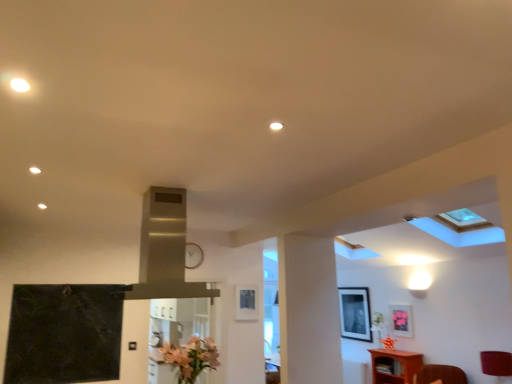
Question: Considering the relative sizes of pink matte flower at lower center and matte black picture frame at upper center, which is the 1th picture frame in left-to-right order, in the image provided, is pink matte flower at lower center bigger than matte black picture frame at upper center, which is the 1th picture frame in left-to-right order,?

Choices:
 (A) yes
 (B) no

Answer: (A)

Question: Does pink matte flower at lower center appear on the left side of matte black picture frame at upper center, which appears as the third picture frame when viewed from the right?

Choices:
 (A) yes
 (B) no

Answer: (A)

Question: Does pink matte flower at lower center have a greater height compared to matte black picture frame at upper center, which appears as the third picture frame when viewed from the right?

Choices:
 (A) yes
 (B) no

Answer: (A)

Question: Are pink matte flower at lower center and matte black picture frame at upper center, marked as the 3th picture frame in a back-to-front arrangement, far apart?

Choices:
 (A) yes
 (B) no

Answer: (B)

Question: Does pink matte flower at lower center have a lesser width compared to matte black picture frame at upper center, which is the 1th picture frame in left-to-right order?

Choices:
 (A) no
 (B) yes

Answer: (A)

Question: Does point (189, 342) appear closer or farther from the camera than point (153, 190)?

Choices:
 (A) farther
 (B) closer

Answer: (A)

Question: From their relative heights in the image, would you say pink matte flower at lower center is taller or shorter than stainless steel exhaust hood at center?

Choices:
 (A) short
 (B) tall

Answer: (A)

Question: From a real-world perspective, relative to stainless steel exhaust hood at center, is pink matte flower at lower center vertically above or below?

Choices:
 (A) above
 (B) below

Answer: (B)

Question: Is pink matte flower at lower center bigger or smaller than stainless steel exhaust hood at center?

Choices:
 (A) big
 (B) small

Answer: (B)

Question: Based on their sizes in the image, would you say matte pink picture frame at upper right, which is the first picture frame from right to left, is bigger or smaller than matte black picture frame at upper right, acting as the first picture frame starting from the back?

Choices:
 (A) small
 (B) big

Answer: (A)

Question: In terms of height, does matte pink picture frame at upper right, which is the second picture frame from front to back, look taller or shorter compared to matte black picture frame at upper right, the second picture frame from the right?

Choices:
 (A) tall
 (B) short

Answer: (B)

Question: From the image's perspective, is matte pink picture frame at upper right, which is the 3th picture frame from left to right, above or below matte black picture frame at upper right, the second picture frame from the right?

Choices:
 (A) above
 (B) below

Answer: (A)

Question: Visually, is matte pink picture frame at upper right, which is the 3th picture frame from left to right, positioned to the left or to the right of matte black picture frame at upper right, which appears as the 3th picture frame when viewed from the front?

Choices:
 (A) right
 (B) left

Answer: (A)

Question: In terms of height, does metallic clock at center look taller or shorter compared to matte black picture frame at upper center, which is the 1th picture frame in left-to-right order?

Choices:
 (A) short
 (B) tall

Answer: (A)

Question: Is metallic clock at center wider or thinner than matte black picture frame at upper center, which is the 1th picture frame in left-to-right order?

Choices:
 (A) thin
 (B) wide

Answer: (A)